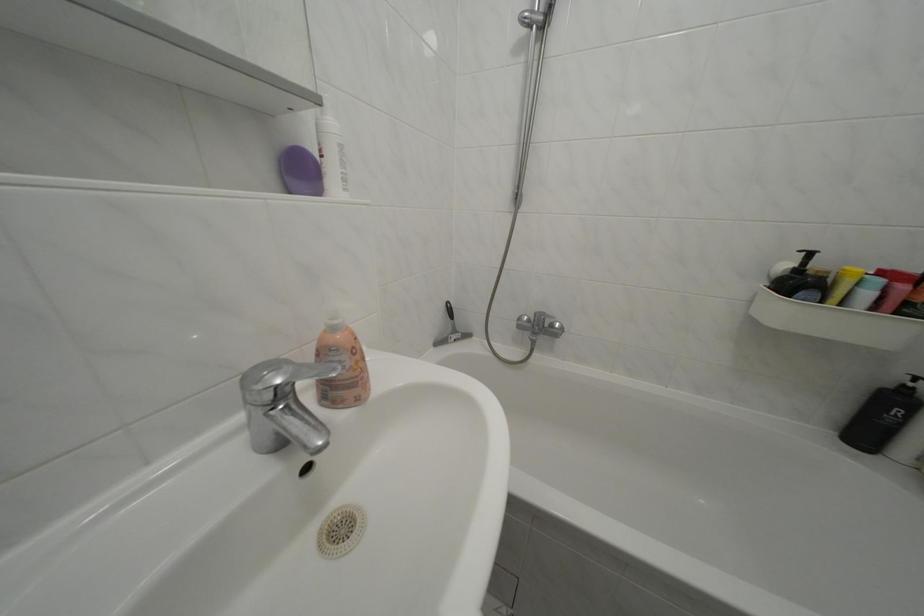
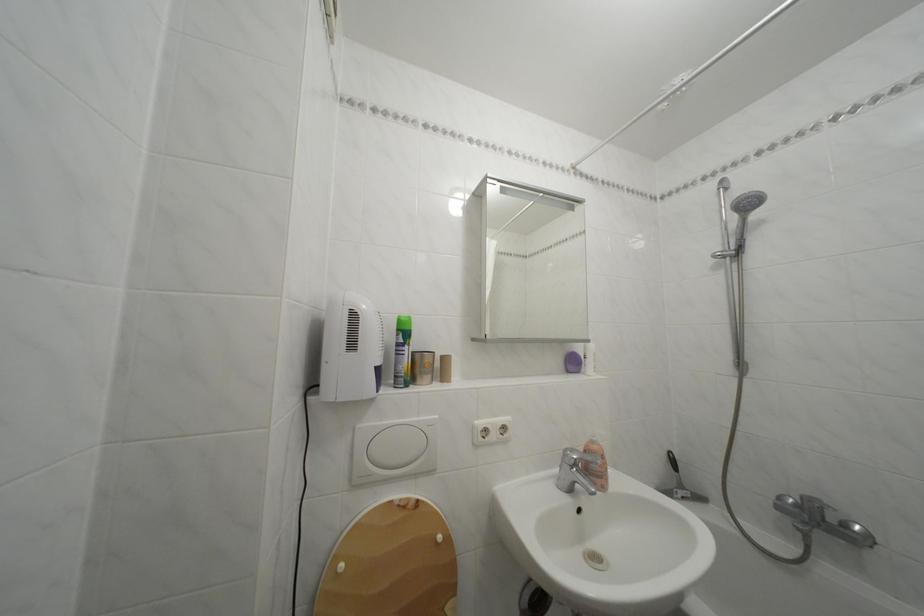
Locate, in the second image, the point that corresponds to the point at 342,334 in the first image.

(602, 448)